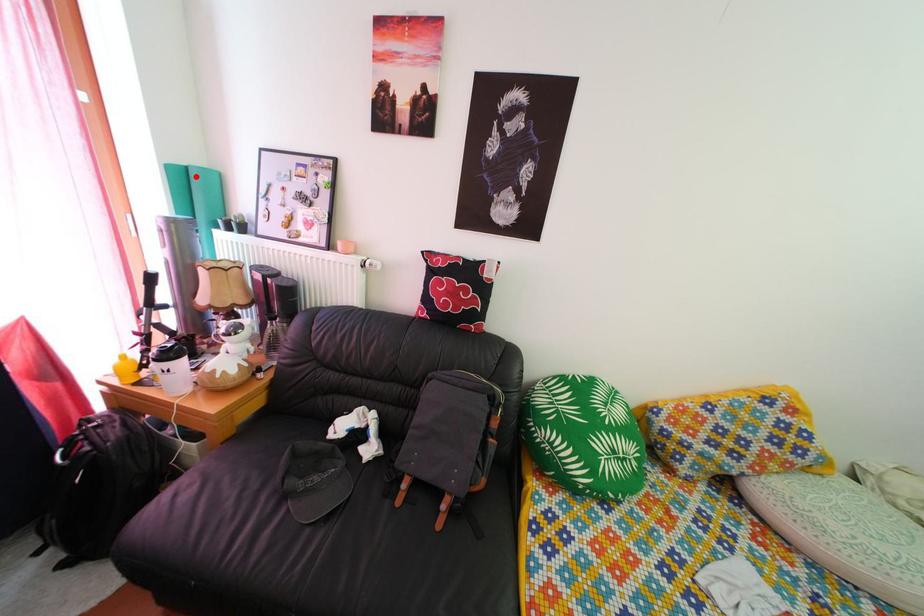
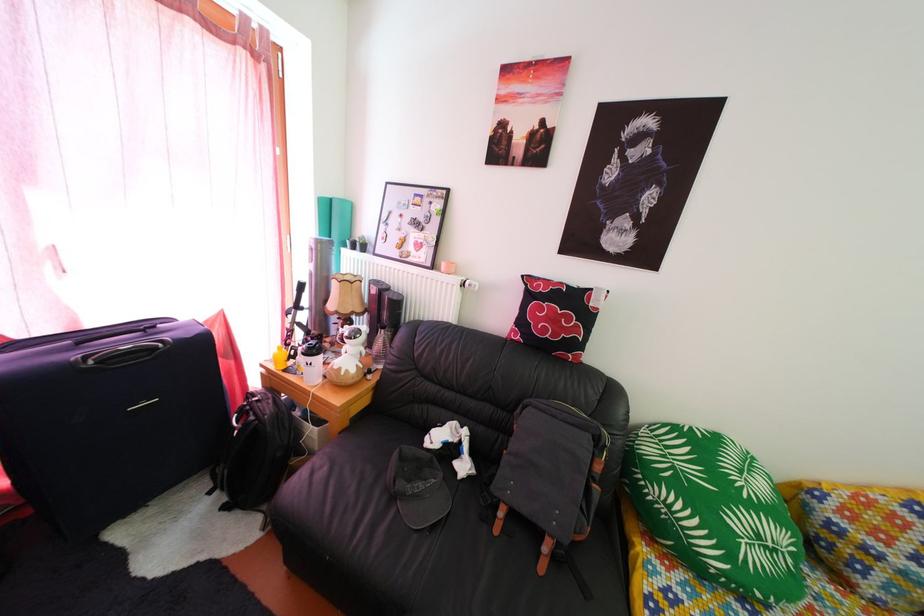
Question: I am providing you with two images of the same scene from different viewpoints. Image1 has a red point marked. In image2, the corresponding 3D location appears at what relative position? Reply with the corresponding letter.

Choices:
 (A) Closer
 (B) Farther

Answer: (A)